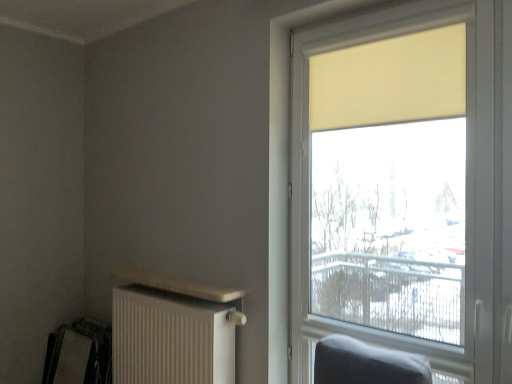
Identify the location of metallic silver swivel chair at lower left. (79, 354).

From the image's perspective, which one is positioned lower, matte yellow roller shade at right or white textured radiator at lower left?

white textured radiator at lower left, from the image's perspective.

From a real-world perspective, is matte yellow roller shade at right on white textured radiator at lower left?

Yes, from a real-world perspective, matte yellow roller shade at right is above white textured radiator at lower left.

Find the location of a particular element. The width and height of the screenshot is (512, 384). radiator located below the matte yellow roller shade at right (from the image's perspective) is located at coordinates (170, 338).

Which is behind, metallic silver swivel chair at lower left or beige fabric curtain at upper right?

metallic silver swivel chair at lower left is further away from the camera.

Identify the location of swivel chair behind the beige fabric curtain at upper right. 79,354.

Looking at the image, does metallic silver swivel chair at lower left seem bigger or smaller compared to beige fabric curtain at upper right?

Considering their sizes, metallic silver swivel chair at lower left takes up more space than beige fabric curtain at upper right.

Between metallic silver swivel chair at lower left and beige fabric curtain at upper right, which one has larger width?

metallic silver swivel chair at lower left is wider.

Considering the sizes of beige fabric curtain at upper right and white textured radiator at lower left in the image, is beige fabric curtain at upper right wider or thinner than white textured radiator at lower left?

Considering their sizes, beige fabric curtain at upper right looks slimmer than white textured radiator at lower left.

Considering the sizes of objects beige fabric curtain at upper right and white textured radiator at lower left in the image provided, who is smaller, beige fabric curtain at upper right or white textured radiator at lower left?

beige fabric curtain at upper right.

From a real-world perspective, which is physically below, matte yellow roller shade at right or beige fabric curtain at upper right?

matte yellow roller shade at right is physically lower.

Find the location of a particular element. Image resolution: width=512 pixels, height=384 pixels. curtain to the right of matte yellow roller shade at right is located at coordinates (390, 81).

Considering the sizes of objects matte yellow roller shade at right and beige fabric curtain at upper right in the image provided, who is shorter, matte yellow roller shade at right or beige fabric curtain at upper right?

beige fabric curtain at upper right.

Looking at this image, does matte yellow roller shade at right appear on the right side of beige fabric curtain at upper right?

No.

Is beige fabric curtain at upper right beside metallic silver swivel chair at lower left?

No, beige fabric curtain at upper right is not making contact with metallic silver swivel chair at lower left.

Looking at this image, based on their positions, is beige fabric curtain at upper right located to the left or right of metallic silver swivel chair at lower left?

In the image, beige fabric curtain at upper right appears on the right side of metallic silver swivel chair at lower left.

Is beige fabric curtain at upper right positioned beyond the bounds of metallic silver swivel chair at lower left?

beige fabric curtain at upper right lies outside metallic silver swivel chair at lower left's area.

From a real-world perspective, between beige fabric curtain at upper right and metallic silver swivel chair at lower left, who is vertically higher?

In real-world perspective, beige fabric curtain at upper right is above.

Which is in front, matte yellow roller shade at right or metallic silver swivel chair at lower left?

matte yellow roller shade at right is closer to the camera.

Looking at their sizes, would you say matte yellow roller shade at right is wider or thinner than metallic silver swivel chair at lower left?

In the image, matte yellow roller shade at right appears to be wider than metallic silver swivel chair at lower left.

The height and width of the screenshot is (384, 512). Identify the location of window on the right of the metallic silver swivel chair at lower left. (466, 180).

Based on their sizes in the image, would you say matte yellow roller shade at right is bigger or smaller than metallic silver swivel chair at lower left?

Clearly, matte yellow roller shade at right is larger in size than metallic silver swivel chair at lower left.

In the scene shown: Is metallic silver swivel chair at lower left bigger than matte yellow roller shade at right?

No.

Which is closer to the camera, (50, 368) or (319, 40)?

Point (50, 368) is positioned farther from the camera compared to point (319, 40).

Could matte yellow roller shade at right be considered to be inside metallic silver swivel chair at lower left?

No.

From the image's perspective, is metallic silver swivel chair at lower left below matte yellow roller shade at right?

Indeed, from the image's perspective, metallic silver swivel chair at lower left is shown beneath matte yellow roller shade at right.

Identify the location of radiator below the matte yellow roller shade at right (from a real-world perspective). (170, 338).

Find the location of a particular element. Image resolution: width=512 pixels, height=384 pixels. swivel chair behind the beige fabric curtain at upper right is located at coordinates (79, 354).

Estimate the real-world distances between objects in this image. Which object is further from matte yellow roller shade at right, white textured radiator at lower left or metallic silver swivel chair at lower left?

Among the two, metallic silver swivel chair at lower left is located further to matte yellow roller shade at right.

Looking at the image, which one is located closer to beige fabric curtain at upper right, metallic silver swivel chair at lower left or matte yellow roller shade at right?

matte yellow roller shade at right lies closer to beige fabric curtain at upper right than the other object.

Based on their spatial positions, is white textured radiator at lower left or beige fabric curtain at upper right closer to matte yellow roller shade at right?

Based on the image, beige fabric curtain at upper right appears to be nearer to matte yellow roller shade at right.

Which object lies nearer to the anchor point white textured radiator at lower left, beige fabric curtain at upper right or matte yellow roller shade at right?

matte yellow roller shade at right lies closer to white textured radiator at lower left than the other object.

Estimate the real-world distances between objects in this image. Which object is closer to beige fabric curtain at upper right, white textured radiator at lower left or metallic silver swivel chair at lower left?

white textured radiator at lower left is closer to beige fabric curtain at upper right.

Consider the image. Which object lies further to the anchor point metallic silver swivel chair at lower left, matte yellow roller shade at right or white textured radiator at lower left?

matte yellow roller shade at right.

Based on their spatial positions, is white textured radiator at lower left or beige fabric curtain at upper right closer to metallic silver swivel chair at lower left?

Based on the image, white textured radiator at lower left appears to be nearer to metallic silver swivel chair at lower left.

Which object lies nearer to the anchor point metallic silver swivel chair at lower left, beige fabric curtain at upper right or white textured radiator at lower left?

white textured radiator at lower left is positioned closer to the anchor metallic silver swivel chair at lower left.

This screenshot has height=384, width=512. I want to click on window located between metallic silver swivel chair at lower left and beige fabric curtain at upper right in the left-right direction, so click(466, 180).

Identify the location of window between beige fabric curtain at upper right and white textured radiator at lower left in the vertical direction. The height and width of the screenshot is (384, 512). (466, 180).

Locate an element on the screen. The image size is (512, 384). radiator between metallic silver swivel chair at lower left and matte yellow roller shade at right from left to right is located at coordinates (170, 338).

Where is `radiator situated between metallic silver swivel chair at lower left and beige fabric curtain at upper right from left to right`? radiator situated between metallic silver swivel chair at lower left and beige fabric curtain at upper right from left to right is located at coordinates (170, 338).